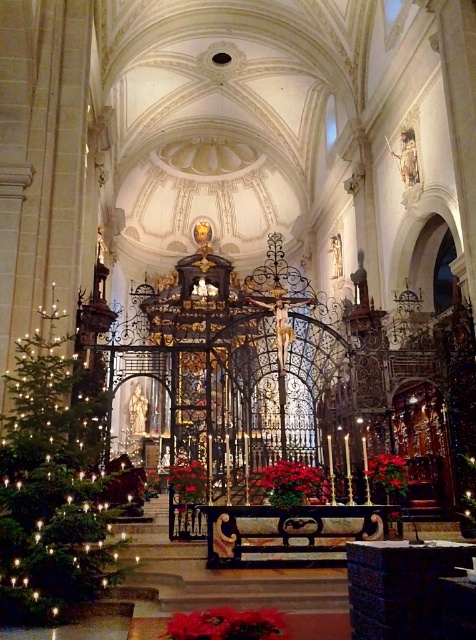
Question: Does green matte christmas tree at left appear under red velvet poinsettia at lower center?

Choices:
 (A) yes
 (B) no

Answer: (B)

Question: Among these objects, which one is farthest from the camera?

Choices:
 (A) green matte christmas tree at left
 (B) red velvet poinsettia at lower center

Answer: (B)

Question: Does green matte christmas tree at left lie behind red velvet poinsettia at lower center?

Choices:
 (A) yes
 (B) no

Answer: (B)

Question: Can you confirm if green matte christmas tree at left is bigger than red velvet poinsettia at lower center?

Choices:
 (A) no
 (B) yes

Answer: (B)

Question: Which point is closer to the camera taking this photo?

Choices:
 (A) (279, 484)
 (B) (49, 483)

Answer: (B)